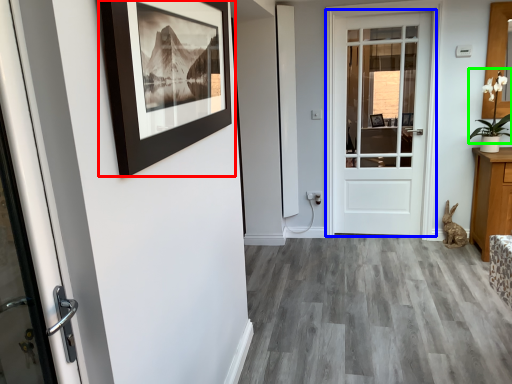
Question: Which is nearer to the picture frame (highlighted by a red box)? door (highlighted by a blue box) or plant (highlighted by a green box).

Choices:
 (A) door
 (B) plant

Answer: (A)